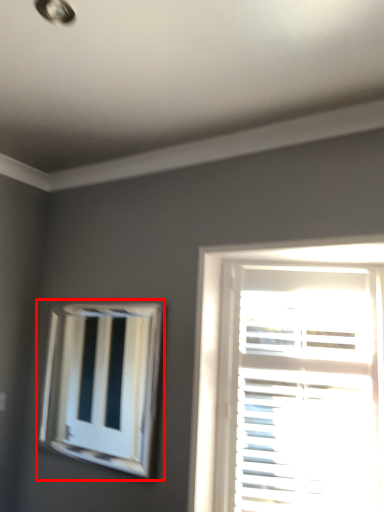
Question: In this image, where is bay window (annotated by the red box) located relative to window?

Choices:
 (A) left
 (B) right

Answer: (A)